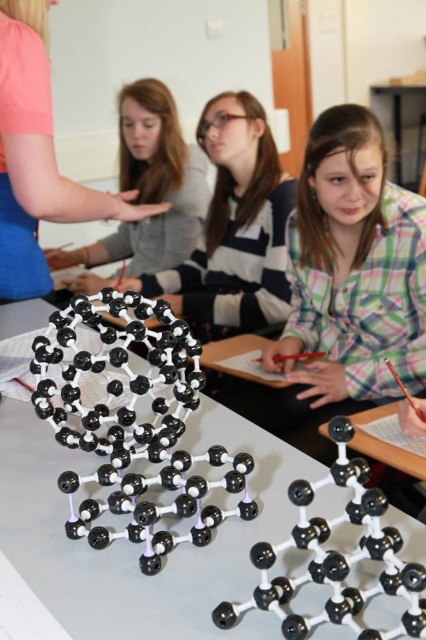
Question: Does pink fabric at upper left come in front of matte black hair at upper center?

Choices:
 (A) yes
 (B) no

Answer: (A)

Question: Considering the real-world distances, which object is farthest from the green plaid shirt at center?

Choices:
 (A) pink fabric at upper left
 (B) black plastic table at center
 (C) matte black hair at upper center

Answer: (B)

Question: Which of the following is the farthest from the observer?

Choices:
 (A) pink fabric at upper left
 (B) matte black hair at upper center
 (C) white plastic molecular model at center

Answer: (B)

Question: Is green plaid shirt at center in front of pink fabric at upper left?

Choices:
 (A) no
 (B) yes

Answer: (A)

Question: Is green plaid shirt at center wider than matte black hair at upper center?

Choices:
 (A) no
 (B) yes

Answer: (A)

Question: Considering the real-world distances, which object is closest to the pink fabric at upper left?

Choices:
 (A) matte black hair at upper center
 (B) black plastic table at center
 (C) green plaid shirt at center
 (D) white plastic molecular model at center

Answer: (D)